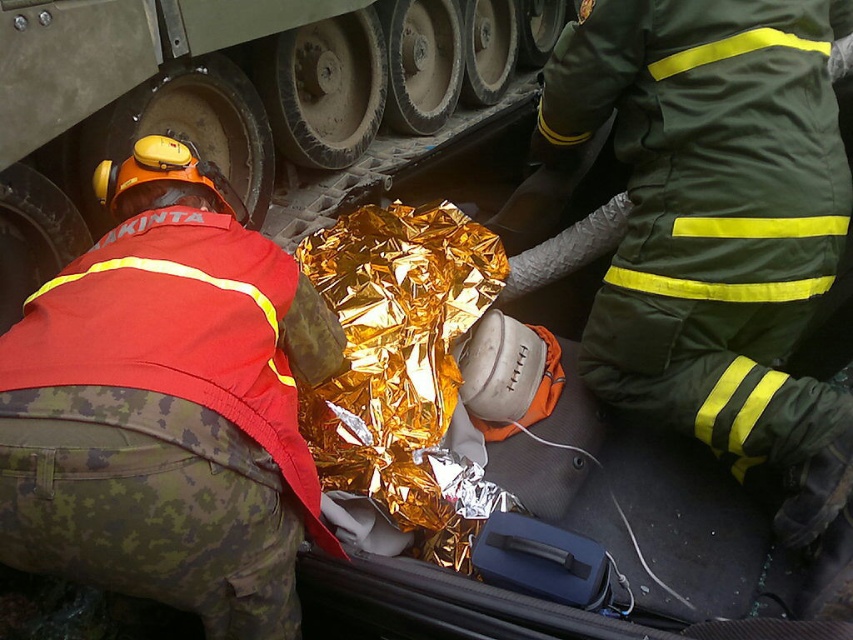
Question: Which of the following is the farthest from the observer?

Choices:
 (A) (245, 616)
 (B) (61, 22)
 (C) (735, 323)

Answer: (C)

Question: Which object is positioned closest to the camouflage pants at lower left?

Choices:
 (A) metallic gray tank track at center
 (B) green matte uniform at center

Answer: (A)

Question: Can you confirm if green matte uniform at center is positioned above metallic gray tank track at center?

Choices:
 (A) no
 (B) yes

Answer: (A)

Question: Does green matte uniform at center appear under metallic gray tank track at center?

Choices:
 (A) yes
 (B) no

Answer: (A)

Question: Does camouflage pants at lower left lie in front of green matte uniform at center?

Choices:
 (A) no
 (B) yes

Answer: (B)

Question: Among these objects, which one is farthest from the camera?

Choices:
 (A) metallic gray tank track at center
 (B) green matte uniform at center

Answer: (B)